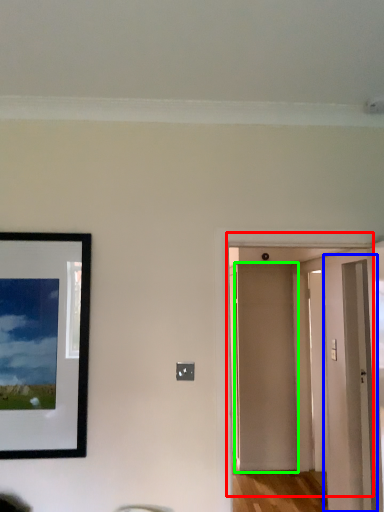
Question: Estimate the real-world distances between objects in this image. Which object is closer to door (highlighted by a red box), glass door (highlighted by a blue box) or door (highlighted by a green box)?

Choices:
 (A) glass door
 (B) door

Answer: (B)